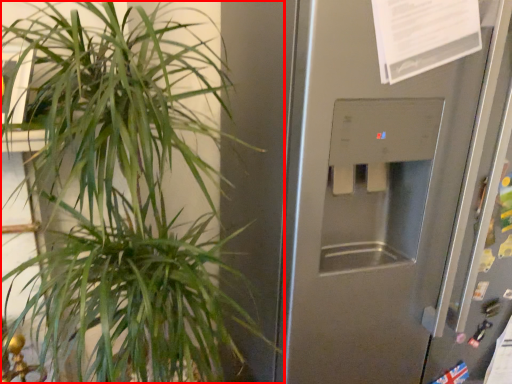
Question: In this image, where is houseplant (annotated by the red box) located relative to screen door?

Choices:
 (A) left
 (B) right

Answer: (A)